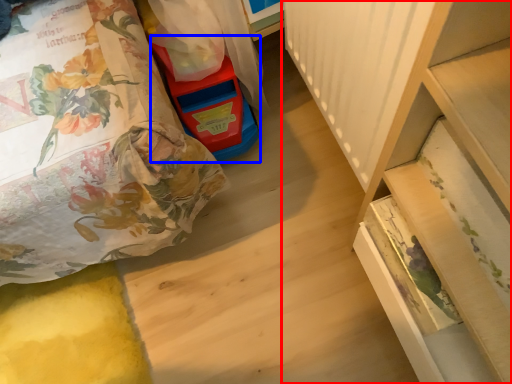
Question: Which object is further to the camera taking this photo, furniture (highlighted by a red box) or toy (highlighted by a blue box)?

Choices:
 (A) furniture
 (B) toy

Answer: (B)